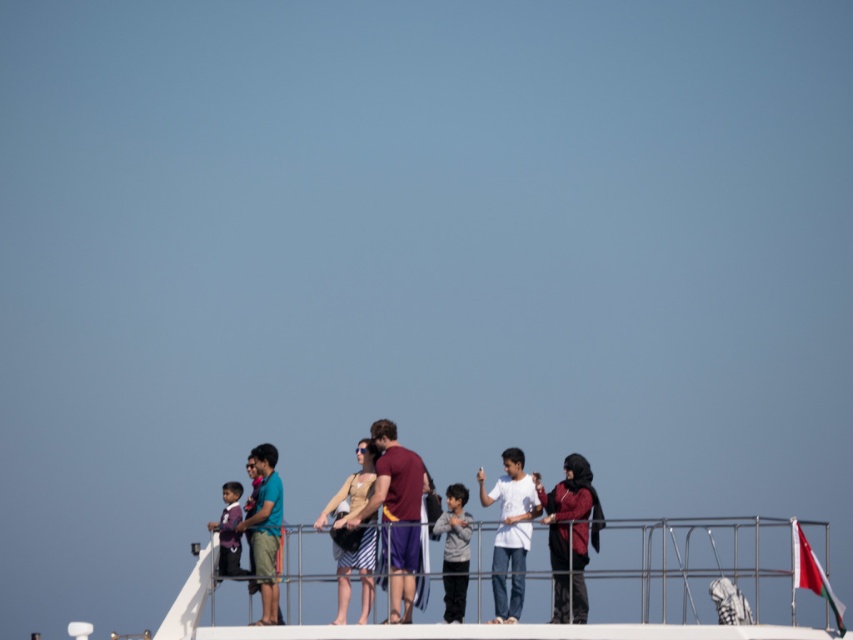
Question: Estimate the real-world distances between objects in this image. Which object is farther from the gray cotton hoodie at center?

Choices:
 (A) maroon fabric jacket at center
 (B) teal fabric shirt at center

Answer: (B)

Question: Which object is closer to the camera taking this photo?

Choices:
 (A) white matte shirt at center
 (B) maroon fabric shirt at center

Answer: (A)

Question: Does gray cotton hoodie at center have a smaller size compared to red fabric flag at right?

Choices:
 (A) no
 (B) yes

Answer: (A)

Question: Among these objects, which one is nearest to the camera?

Choices:
 (A) maroon fabric jacket at center
 (B) maroon fabric shirt at center
 (C) matte purple shirt at center

Answer: (B)

Question: Does gray cotton hoodie at center appear under red fabric flag at right?

Choices:
 (A) no
 (B) yes

Answer: (A)

Question: Can you confirm if maroon fabric jacket at center is positioned to the left of matte purple shirt at center?

Choices:
 (A) yes
 (B) no

Answer: (B)